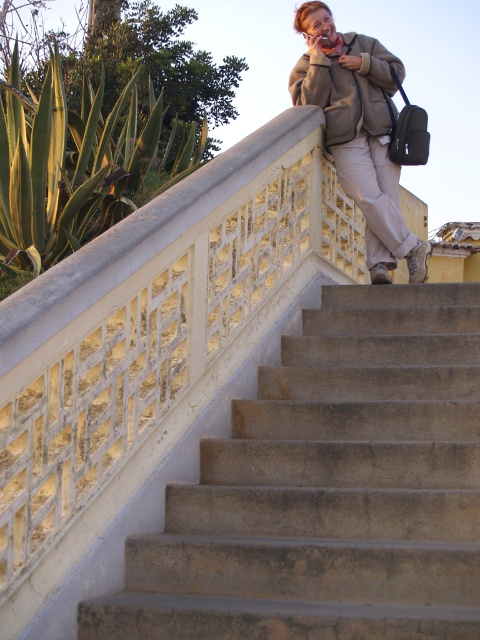
Is concrete stairs at center bigger than matte beige pants at upper center?

Indeed, concrete stairs at center has a larger size compared to matte beige pants at upper center.

Is point (298, 387) closer to viewer compared to point (326, 93)?

Yes, point (298, 387) is in front of point (326, 93).

Does point (462, 580) come closer to viewer compared to point (288, 83)?

Yes, it is.

Where is `concrete stairs at center`? The image size is (480, 640). concrete stairs at center is located at coordinates (328, 490).